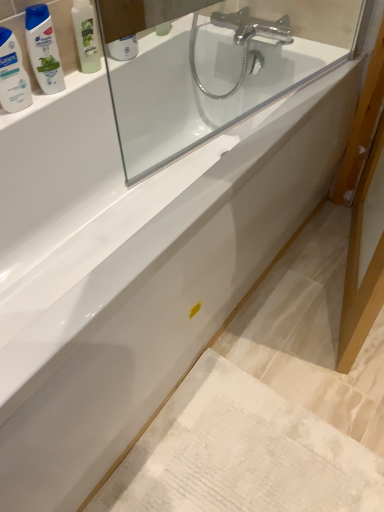
What is the approximate width of white glossy bottle at upper left?

white glossy bottle at upper left is 2.22 inches in width.

The width and height of the screenshot is (384, 512). What do you see at coordinates (86, 36) in the screenshot? I see `green matte shampoo bottle at upper left` at bounding box center [86, 36].

Where is `green plastic mouthwash at upper left`? The image size is (384, 512). green plastic mouthwash at upper left is located at coordinates (43, 49).

What do you see at coordinates (43, 49) in the screenshot? This screenshot has height=512, width=384. I see `green plastic mouthwash at upper left` at bounding box center [43, 49].

Find the location of a particular element. white textured bath mat at lower right is located at coordinates (241, 453).

Considering the positions of point (250, 386) and point (167, 36), is point (250, 386) closer or farther from the camera than point (167, 36)?

Clearly, point (250, 386) is closer to the camera than point (167, 36).

Do you think white textured bath mat at lower right is within transparent glass mirror at upper center, or outside of it?

white textured bath mat at lower right is located beyond the bounds of transparent glass mirror at upper center.

In the image, is white textured bath mat at lower right positioned in front of or behind transparent glass mirror at upper center?

In the image, white textured bath mat at lower right appears behind transparent glass mirror at upper center.

Based on the photo, is there a large distance between white textured bath mat at lower right and transparent glass mirror at upper center?

Actually, white textured bath mat at lower right and transparent glass mirror at upper center are a little close together.

Would you say white glossy bottle at upper left is inside or outside green plastic mouthwash at upper left?

white glossy bottle at upper left is located beyond the bounds of green plastic mouthwash at upper left.

Is white glossy bottle at upper left not close to green plastic mouthwash at upper left?

white glossy bottle at upper left is actually quite close to green plastic mouthwash at upper left.

Consider the image. Considering the sizes of objects white glossy bottle at upper left and green plastic mouthwash at upper left in the image provided, who is bigger, white glossy bottle at upper left or green plastic mouthwash at upper left?

green plastic mouthwash at upper left.

Is white glossy bottle at upper left facing towards green plastic mouthwash at upper left?

No.

Does point (33, 44) appear closer or farther from the camera than point (15, 47)?

Point (33, 44) is positioned farther from the camera compared to point (15, 47).

Is green plastic mouthwash at upper left smaller than white glossy bottle at upper left?

No, green plastic mouthwash at upper left is not smaller than white glossy bottle at upper left.

From the image's perspective, which one is positioned higher, green plastic mouthwash at upper left or white glossy bottle at upper left?

green plastic mouthwash at upper left.

Would you say green plastic mouthwash at upper left contains white glossy bottle at upper left?

No, white glossy bottle at upper left is located outside of green plastic mouthwash at upper left.

From the image's perspective, who appears lower, transparent glass mirror at upper center or green plastic mouthwash at upper left?

From the image's view, transparent glass mirror at upper center is below.

Between transparent glass mirror at upper center and green plastic mouthwash at upper left, which one has less height?

Standing shorter between the two is green plastic mouthwash at upper left.

Can you tell me how much transparent glass mirror at upper center and green plastic mouthwash at upper left differ in facing direction?

8.45 degrees.

Is transparent glass mirror at upper center bigger or smaller than green plastic mouthwash at upper left?

Clearly, transparent glass mirror at upper center is larger in size than green plastic mouthwash at upper left.

How much distance is there between transparent glass mirror at upper center and white glossy bottle at upper left?

They are 23.92 inches apart.

Could you tell me if transparent glass mirror at upper center is facing white glossy bottle at upper left?

No, transparent glass mirror at upper center is not facing towards white glossy bottle at upper left.

Looking at their sizes, would you say transparent glass mirror at upper center is wider or thinner than white glossy bottle at upper left?

Considering their sizes, transparent glass mirror at upper center looks slimmer than white glossy bottle at upper left.

At what (x,y) coordinates should I click in order to perform the action: click on mirror that is in front of the white glossy bottle at upper left. Please return your answer as a coordinate pair (x, y). Looking at the image, I should click on click(213, 65).

Is point (86, 71) closer or farther from the camera than point (40, 62)?

Point (86, 71).

Is green matte shampoo bottle at upper left not near green plastic mouthwash at upper left?

No, green matte shampoo bottle at upper left is not far away from green plastic mouthwash at upper left.

Is green plastic mouthwash at upper left at the back of green matte shampoo bottle at upper left?

That's not correct — green matte shampoo bottle at upper left is not looking away from green plastic mouthwash at upper left.

Where is `toiletry that is on the right side of green plastic mouthwash at upper left`? The height and width of the screenshot is (512, 384). toiletry that is on the right side of green plastic mouthwash at upper left is located at coordinates (86, 36).

How distant is white textured bath mat at lower right from green matte shampoo bottle at upper left?

1.16 meters.

Which of these two, white textured bath mat at lower right or green matte shampoo bottle at upper left, is smaller?

green matte shampoo bottle at upper left is smaller.

Are white textured bath mat at lower right and green matte shampoo bottle at upper left making contact?

No, white textured bath mat at lower right is not making contact with green matte shampoo bottle at upper left.

The image size is (384, 512). Identify the location of bath mat below the transparent glass mirror at upper center (from a real-world perspective). (241, 453).

Locate an element on the screen. The height and width of the screenshot is (512, 384). cleaning product on the left of the green plastic mouthwash at upper left is located at coordinates (13, 74).

Estimate the real-world distances between objects in this image. Which object is further from white glossy bottle at upper left, transparent glass mirror at upper center or green plastic mouthwash at upper left?

transparent glass mirror at upper center is further to white glossy bottle at upper left.

Based on their spatial positions, is white glossy bottle at upper left or green plastic mouthwash at upper left closer to green matte shampoo bottle at upper left?

The object closer to green matte shampoo bottle at upper left is green plastic mouthwash at upper left.

Considering their positions, is green plastic mouthwash at upper left positioned closer to transparent glass mirror at upper center than white textured bath mat at lower right?

Based on the image, green plastic mouthwash at upper left appears to be nearer to transparent glass mirror at upper center.

Looking at the image, which one is located further to white glossy bottle at upper left, green matte shampoo bottle at upper left or green plastic mouthwash at upper left?

green matte shampoo bottle at upper left lies further to white glossy bottle at upper left than the other object.

Estimate the real-world distances between objects in this image. Which object is further from green matte shampoo bottle at upper left, white textured bath mat at lower right or transparent glass mirror at upper center?

The object further to green matte shampoo bottle at upper left is white textured bath mat at lower right.

From the picture: Considering their positions, is green plastic mouthwash at upper left positioned further to transparent glass mirror at upper center than white glossy bottle at upper left?

white glossy bottle at upper left.

From the image, which object appears to be nearer to green matte shampoo bottle at upper left, white textured bath mat at lower right or green plastic mouthwash at upper left?

green plastic mouthwash at upper left.

Considering their positions, is white glossy bottle at upper left positioned closer to white textured bath mat at lower right than green matte shampoo bottle at upper left?

Among the two, white glossy bottle at upper left is located nearer to white textured bath mat at lower right.

You are a GUI agent. You are given a task and a screenshot of the screen. Output one action in this format:
    pyautogui.click(x=<x>, y=<y>)
    Task: Click on the mouthwash between white glossy bottle at upper left and transparent glass mirror at upper center in the horizontal direction
    
    Given the screenshot: What is the action you would take?
    pyautogui.click(x=43, y=49)

Image resolution: width=384 pixels, height=512 pixels. I want to click on cleaning product between green plastic mouthwash at upper left and white textured bath mat at lower right in the up-down direction, so click(13, 74).

Identify the location of toiletry between white glossy bottle at upper left and transparent glass mirror at upper center from left to right. Image resolution: width=384 pixels, height=512 pixels. (86, 36).

Where is `mouthwash between green matte shampoo bottle at upper left and white textured bath mat at lower right from top to bottom`? The image size is (384, 512). mouthwash between green matte shampoo bottle at upper left and white textured bath mat at lower right from top to bottom is located at coordinates (43, 49).